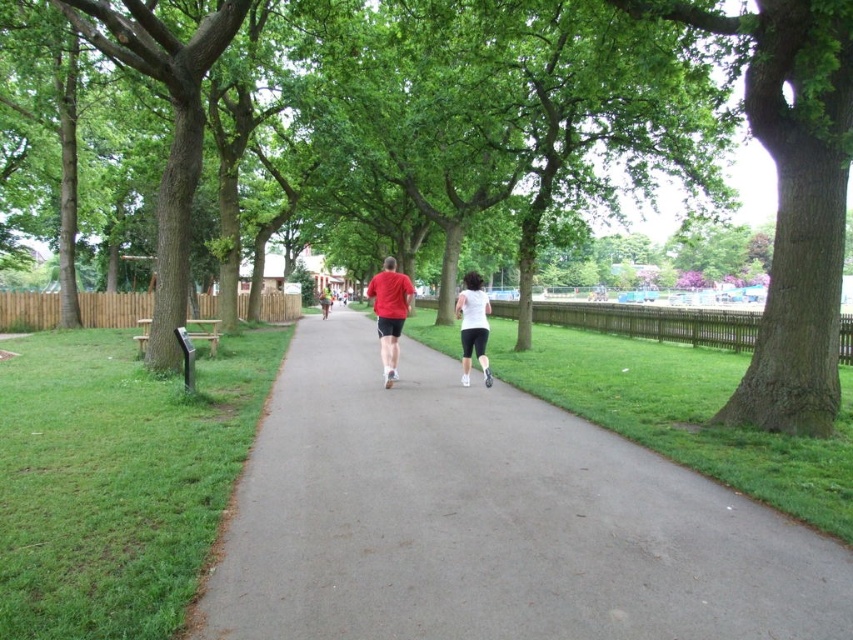
Is point (631, 134) farther from viewer compared to point (469, 301)?

That is True.

Based on the photo, can you confirm if green leafy tree at center is bigger than white matte shorts at center?

Yes.

Image resolution: width=853 pixels, height=640 pixels. Identify the location of green leafy tree at center. (650, 70).

Locate an element on the screen. The width and height of the screenshot is (853, 640). green leafy tree at center is located at coordinates (650, 70).

Does white matte shorts at center have a lesser height compared to matte red shorts at center?

Indeed, white matte shorts at center has a lesser height compared to matte red shorts at center.

Who is more distant from viewer, (476, 300) or (345, 292)?

The point (345, 292) is more distant.

Identify the location of white matte shorts at center. Image resolution: width=853 pixels, height=640 pixels. (473, 324).

Does gray asphalt path at center have a lesser width compared to white matte shorts at center?

In fact, gray asphalt path at center might be wider than white matte shorts at center.

Is point (641, 522) closer to camera compared to point (461, 353)?

Yes, it is in front of point (461, 353).

Locate an element on the screen. This screenshot has height=640, width=853. gray asphalt path at center is located at coordinates (489, 520).